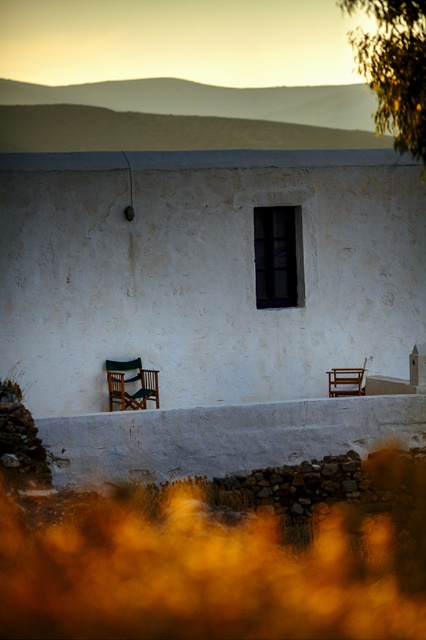
Between point (146, 388) and point (350, 372), which one is positioned behind?

The point (350, 372) is behind.

Which is more to the right, wooden folding chair at lower left or wooden chair at lower right?

wooden chair at lower right is more to the right.

In order to click on wooden folding chair at lower left in this screenshot , I will do `click(129, 381)`.

The width and height of the screenshot is (426, 640). In order to click on wooden folding chair at lower left in this screenshot , I will do `click(129, 381)`.